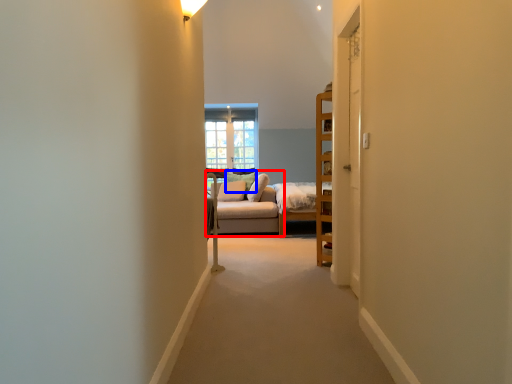
Question: Which object is closer to the camera taking this photo, studio couch (highlighted by a red box) or pillow (highlighted by a blue box)?

Choices:
 (A) studio couch
 (B) pillow

Answer: (A)